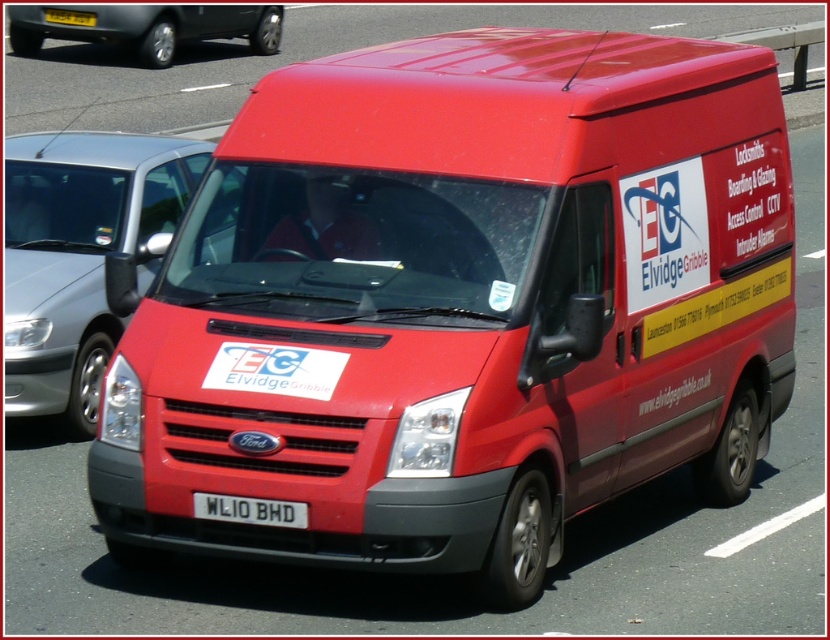
Between point (72, 266) and point (159, 12), which one is positioned behind?

Positioned behind is point (159, 12).

Who is more forward, [52,289] or [155,26]?

Positioned in front is point [52,289].

Image resolution: width=830 pixels, height=640 pixels. Identify the location of matte red van at center. (81, 253).

Between metallic gray car at upper left and white plastic license plate at center, which one has more height?

Standing taller between the two is metallic gray car at upper left.

Can you confirm if metallic gray car at upper left is positioned below white plastic license plate at center?

Actually, metallic gray car at upper left is above white plastic license plate at center.

The height and width of the screenshot is (640, 830). What do you see at coordinates (149, 28) in the screenshot?
I see `metallic gray car at upper left` at bounding box center [149, 28].

Locate an element on the screen. metallic gray car at upper left is located at coordinates (149, 28).

How distant is white plastic license plate at center from yellow plastic license plate at center?

The distance of white plastic license plate at center from yellow plastic license plate at center is 57.19 feet.

Between white plastic license plate at center and yellow plastic license plate at center, which one is positioned lower?

white plastic license plate at center is below.

Does point (272, 525) come farther from viewer compared to point (83, 22)?

No.

Where is `white plastic license plate at center`? The height and width of the screenshot is (640, 830). white plastic license plate at center is located at coordinates (249, 509).